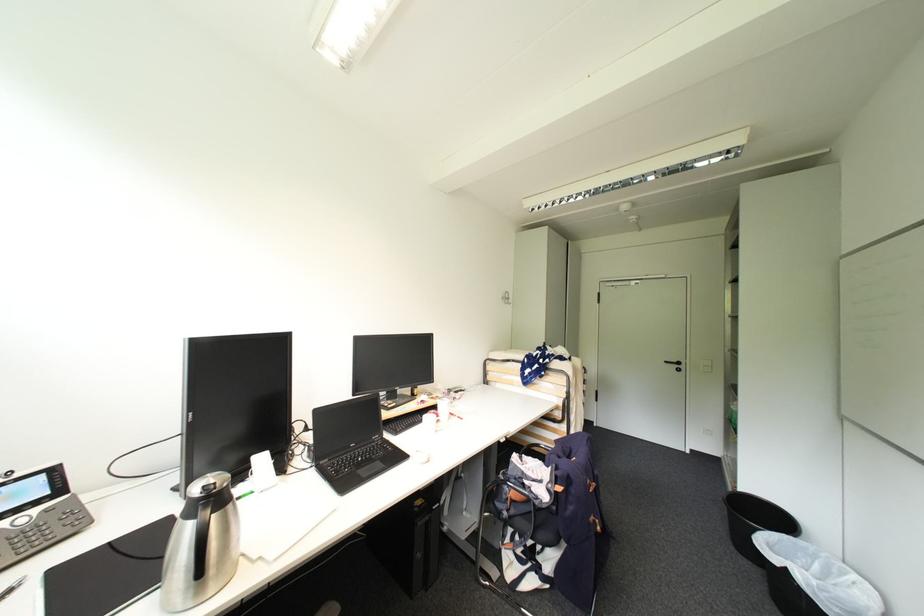
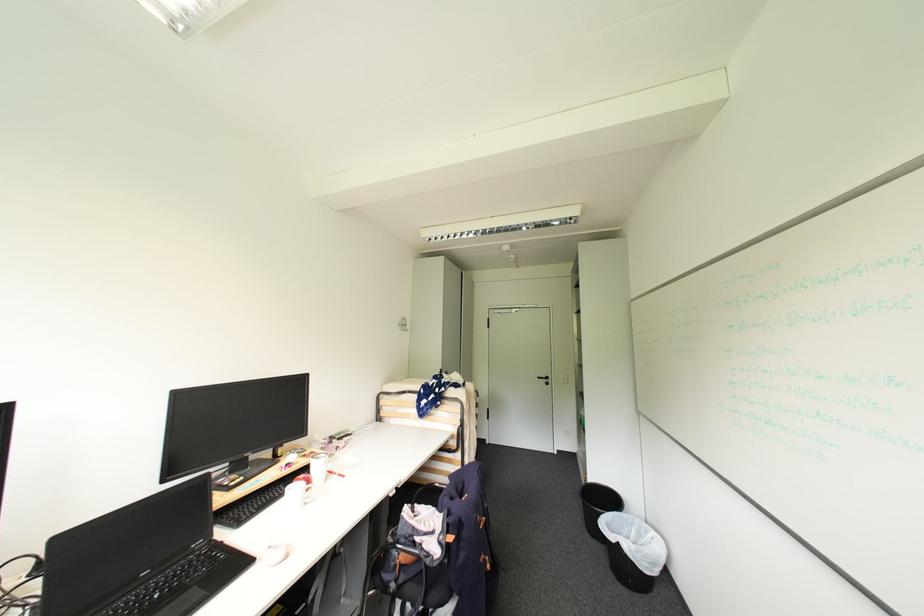
In the second image, find the point that corresponds to (439,399) in the first image.

(311, 456)